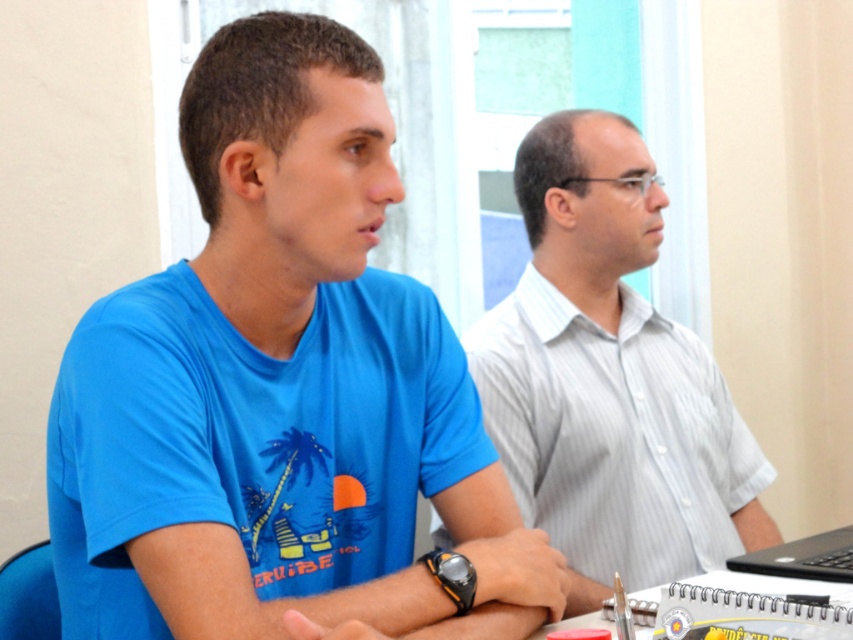
Question: Which point appears farthest from the camera in this image?

Choices:
 (A) (263, 435)
 (B) (567, 195)

Answer: (B)

Question: Is blue cotton shirt at center bigger than white striped shirt at center?

Choices:
 (A) yes
 (B) no

Answer: (B)

Question: In this image, where is blue cotton shirt at center located relative to white striped shirt at center?

Choices:
 (A) below
 (B) above

Answer: (A)

Question: Which point is farther from the camera taking this photo?

Choices:
 (A) (405, 552)
 (B) (583, 529)

Answer: (B)

Question: Is blue cotton shirt at center to the right of white striped shirt at center from the viewer's perspective?

Choices:
 (A) yes
 (B) no

Answer: (B)